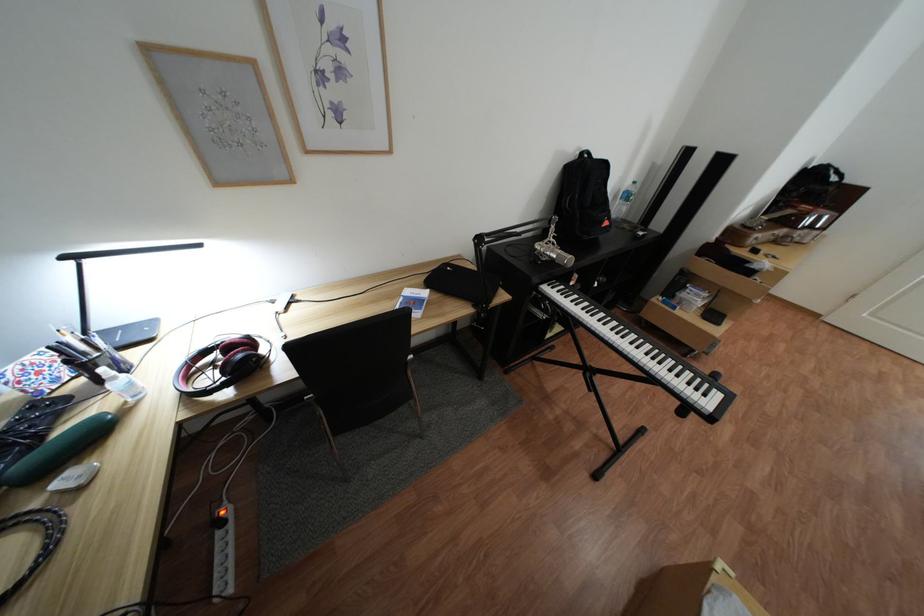
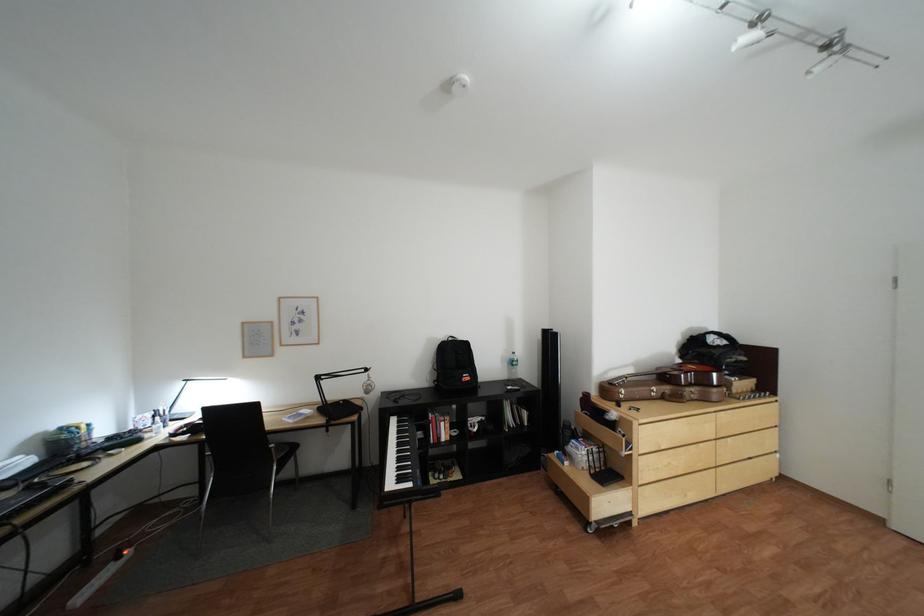
Find the pixel in the second image that matches (x=815, y=233) in the first image.

(703, 391)